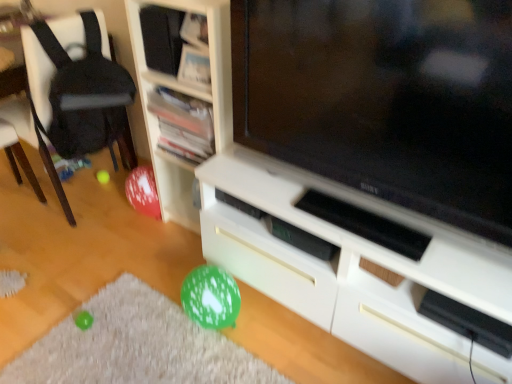
Question: From the image's perspective, is black fabric chair at left positioned above or below matte black television at center?

Choices:
 (A) above
 (B) below

Answer: (A)

Question: Is black fabric chair at left inside the boundaries of matte black television at center, or outside?

Choices:
 (A) outside
 (B) inside

Answer: (A)

Question: Estimate the real-world distances between objects in this image. Which object is closer to the white wood shelf at center, positioned as the first shelf in bottom-to-top order?

Choices:
 (A) matte black speaker at upper center, which is the first shelf from top to bottom
 (B) black fabric chair at left
 (C) wooden bookshelf at upper center, the 2th shelf when ordered from top to bottom
 (D) white matte cabinet at center
 (E) matte black television at center

Answer: (C)

Question: Which of these objects is positioned closest to the matte black speaker at upper center, which is the first shelf from top to bottom?

Choices:
 (A) matte black television at center
 (B) wooden bookshelf at upper center, the 2th shelf when ordered from top to bottom
 (C) white wood shelf at center, marked as the third shelf in a top-to-bottom arrangement
 (D) black fabric chair at left
 (E) white matte cabinet at center

Answer: (C)